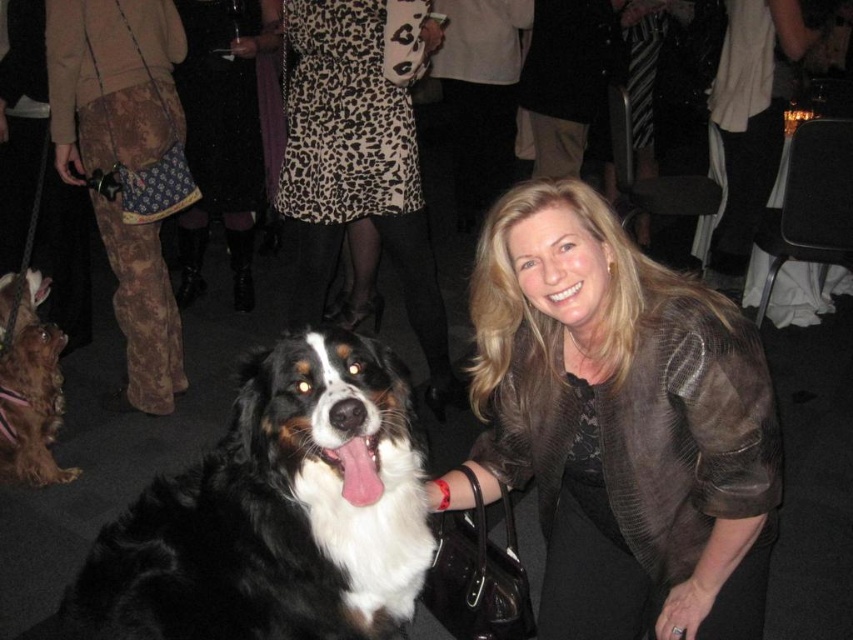
You are a photographer standing at point [199,586]. You want to take a photo of the woman and the dog. Can you fit both subjects in the frame if your camera has a 1.2 meter wide field of view?

The distance between the woman and the dog is 1.32 meters. Since the camera has a 1.2 meter wide field of view, which is narrower than the distance between them, you cannot fit both subjects in the frame.

You are a fashion stylist analyzing the image. The woman is wearing a brown leather jacket at center and a leopard print dress at center. Which clothing item is closer to the camera?

The brown leather jacket at center is positioned under the leopard print dress at center, so the leopard print dress at center is closer to the camera.

You are a fashion designer observing the image. You need to decide which item to feature first in your catalog. Based on their sizes in the image, which of the two items, the brown leather jacket at center or the leopard print dress at center, should be highlighted as the larger piece?

The leopard print dress at center is larger than the brown leather jacket at center, so it should be highlighted as the larger piece.